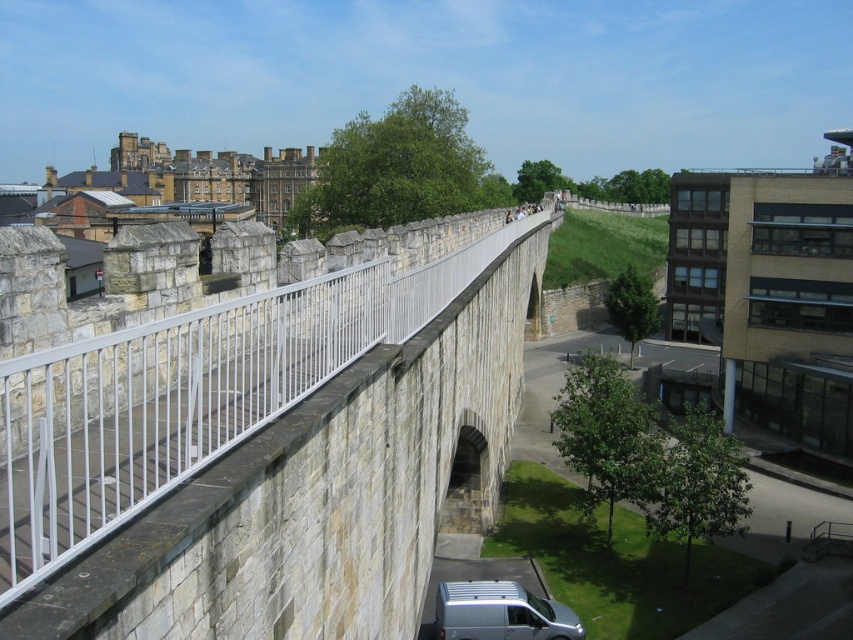
Who is more forward, (315, 332) or (490, 589)?

Point (315, 332) is in front.

Does point (283, 358) come behind point (535, 616)?

No, (283, 358) is closer to viewer.

Locate an element on the screen. stone bridge at center is located at coordinates (271, 442).